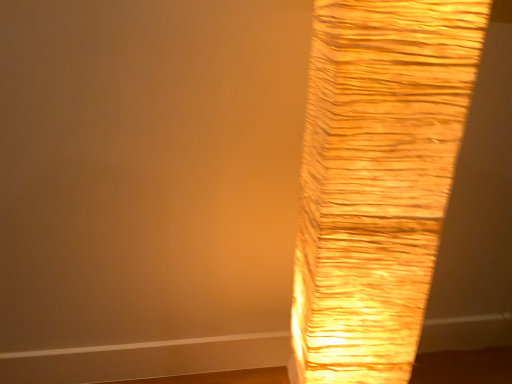
Locate an element on the screen. rippled paper lamp at right is located at coordinates (377, 179).

What do you see at coordinates (377, 179) in the screenshot?
I see `rippled paper lamp at right` at bounding box center [377, 179].

The height and width of the screenshot is (384, 512). I want to click on rippled paper lamp at right, so click(377, 179).